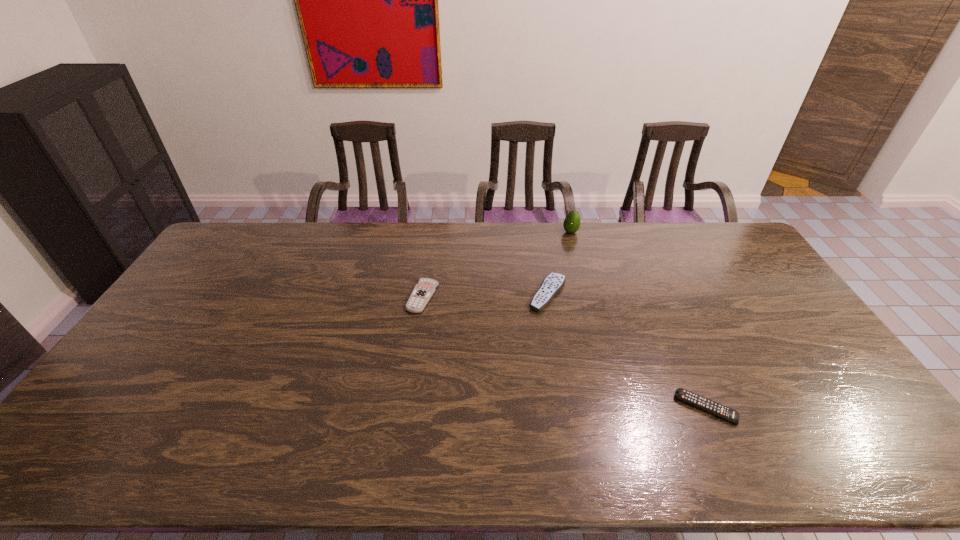
This screenshot has width=960, height=540. Identify the location of free space located on the right of the rightmost remote control. (852, 408).

Where is `object that is positioned at the far edge`? Image resolution: width=960 pixels, height=540 pixels. object that is positioned at the far edge is located at coordinates (572, 222).

Where is `vacant space at the far edge of the desktop`? vacant space at the far edge of the desktop is located at coordinates (574, 256).

Locate an element on the screen. free region at the near edge is located at coordinates (374, 454).

Identify the location of vacant space at the left edge of the desktop. The width and height of the screenshot is (960, 540). (131, 402).

You are a GUI agent. You are given a task and a screenshot of the screen. Output one action in this format:
    pyautogui.click(x=<x>, y=<y>)
    Task: Click on the free region at the right edge of the desktop
    
    Given the screenshot: What is the action you would take?
    pyautogui.click(x=796, y=322)

What are the coordinates of `vacant region at the far left corner of the desktop` in the screenshot? It's located at (258, 231).

Locate an element on the screen. The image size is (960, 540). free space between the farthest object and the leftmost object is located at coordinates (496, 265).

Where is `free space between the farthest object and the tallest remote control`? Image resolution: width=960 pixels, height=540 pixels. free space between the farthest object and the tallest remote control is located at coordinates [560, 263].

Find the location of `free space between the farthest object and the leftmost object`. free space between the farthest object and the leftmost object is located at coordinates (496, 265).